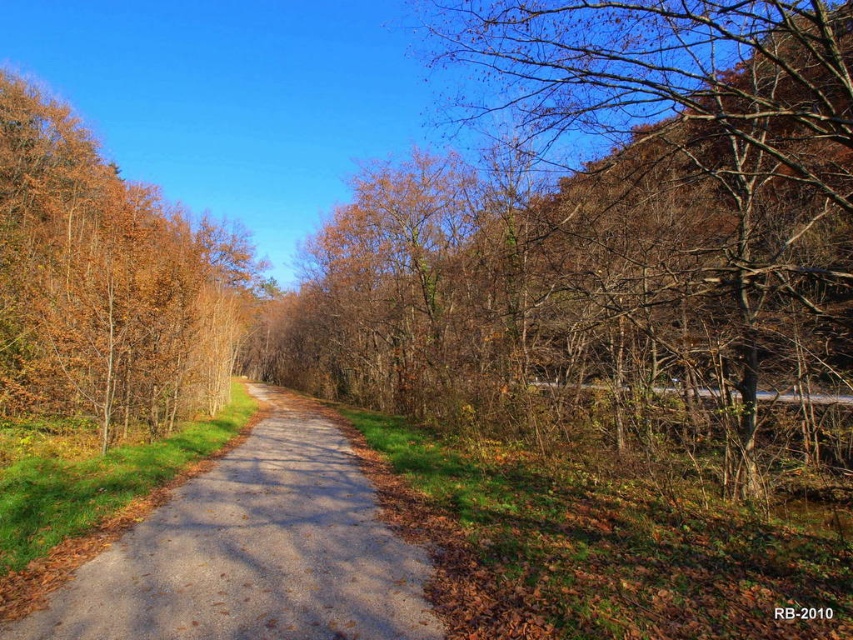
You are a hiker carrying a backpack and want to take a photo of the brown leafy tree at left from the gray asphalt trail at center. Given that your camera has a maximum focus range of 6 meters, will you be able to capture the tree clearly without moving closer?

The brown leafy tree at left and gray asphalt trail at center are 6.88 meters apart. Since the camera can only focus up to 6 meters, you won not be able to capture the tree clearly without moving closer.

You are standing on the gray asphalt trail at center and want to take a photo of the brown leafy tree at left. Which direction should you face to capture the tree in your camera view?

The brown leafy tree at left is located above the gray asphalt trail at center, so you should face upward to capture the tree in your camera view.